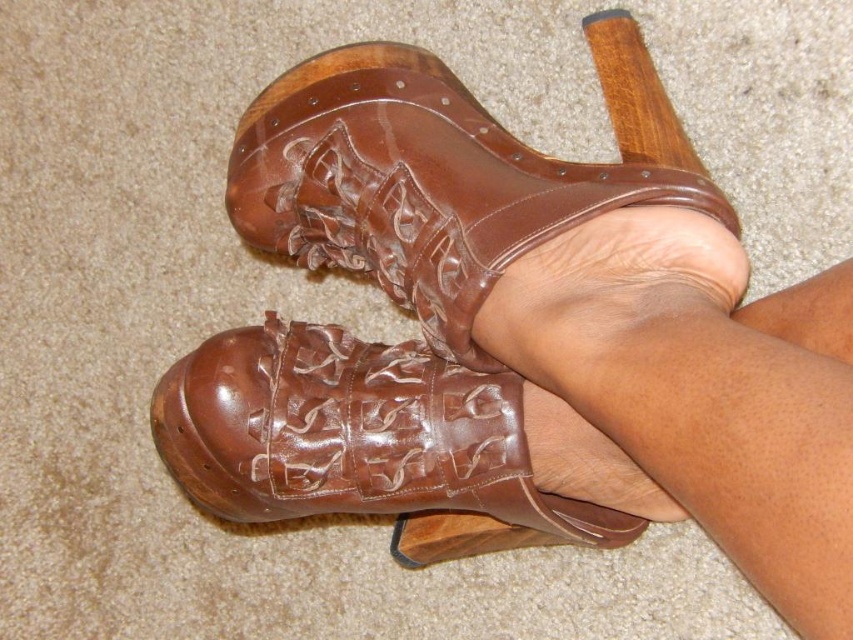
You are trying to decide which shoe to wear for a casual walk. You see the shiny brown leather shoes at center and the brown leather shoe at center. Which one is on the right side?

The shiny brown leather shoes at center is positioned on the right side of brown leather shoe at center.

In the scene shown: You are trying to put on your footwear. You see the shiny brown leather shoes at center and the brown leather boot at center. Which one is covering the other?

The shiny brown leather shoes at center is positioned under the brown leather boot at center, so the brown leather boot at center is covering it.

You are standing in front of a beige carpet and see a pair of brown leather clogs. One of the clogs, the brown leather boot at center, is placed at a specific coordinate. Can you determine if this coordinate is closer to the top or bottom of the image?

The brown leather boot at center is located at point [442,173]. Since the y coordinate is 0.519, which is above the midpoint of 0.5, it is closer to the top of the image.